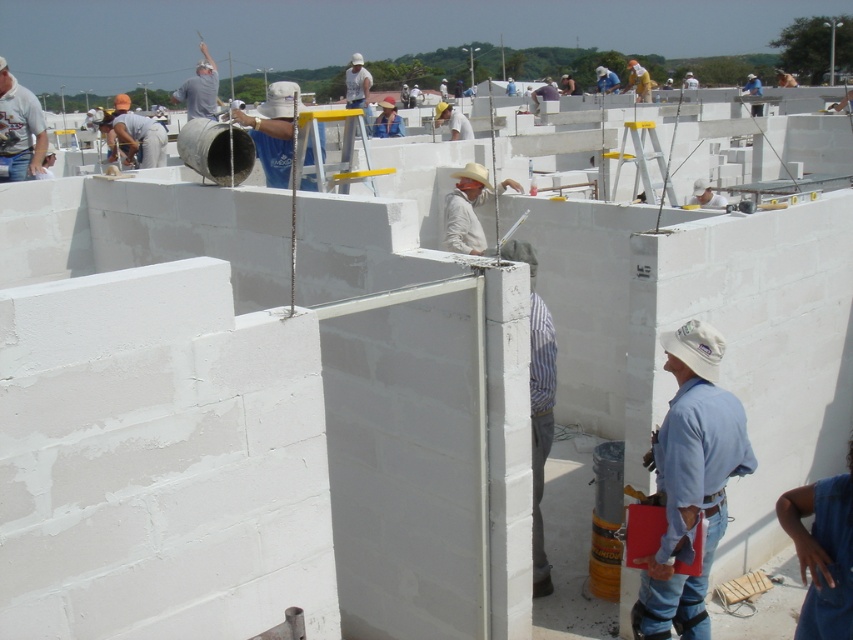
You are a safety inspector at the construction site. You notice two workers in the image. One is the white matte concrete worker at center and the other is the gray cotton shirt at upper center. Which worker appears to be more slender in your view?

The white matte concrete worker at center is thinner than the gray cotton shirt at upper center, so the white matte concrete worker at center appears more slender.

You are a construction worker who needs to hand over a blueprint to your supervisor. You see the white striped shirt at center and the white cotton shirt at upper left. Which one is your supervisor likely wearing?

The supervisor is likely wearing the white striped shirt at center because they are positioned lower, which often indicates a supervisory role overseeing the work from a central position.

You are a safety inspector at the construction site. You notice two workers wearing white shirts. One is wearing a white striped shirt at center and the other a white cotton shirt at upper left. Which worker is standing taller?

The white striped shirt at center is taller than the white cotton shirt at upper left.